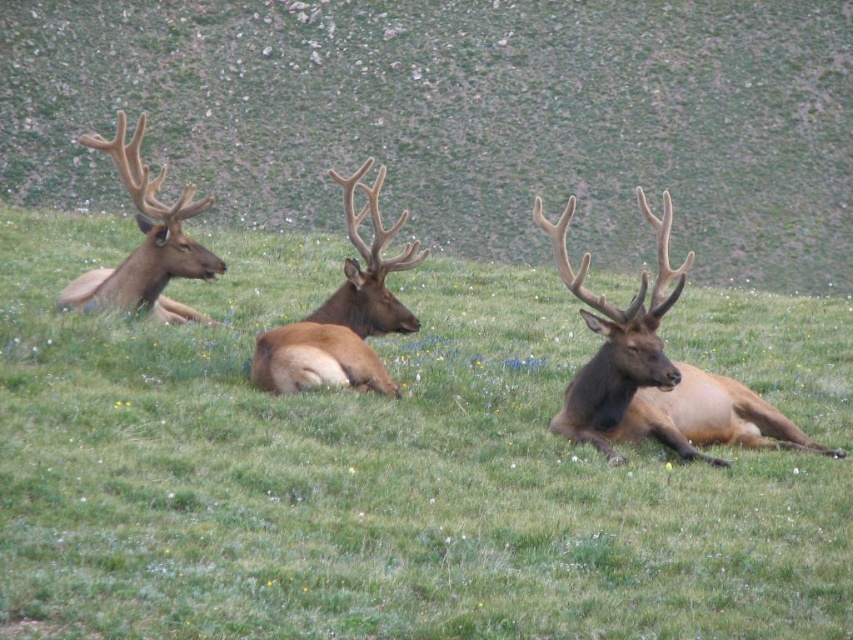
Question: Is the position of brown velvet elk at center more distant than that of brown velvet antlers at left?

Choices:
 (A) no
 (B) yes

Answer: (B)

Question: Which point is farther to the camera?

Choices:
 (A) green grass at center
 (B) brown velvet antlers at left

Answer: (B)

Question: Which of the following is the closest to the observer?

Choices:
 (A) green grass at center
 (B) brown velvet deer at center
 (C) brown velvet antlers at left

Answer: (A)

Question: Does green grass at center have a smaller size compared to brown velvet deer at center?

Choices:
 (A) yes
 (B) no

Answer: (B)

Question: Based on their relative distances, which object is farther from the brown velvet deer at center?

Choices:
 (A) brown velvet antler at center
 (B) brown velvet antlers at left
 (C) brown velvet elk at center
 (D) green grass at center

Answer: (C)

Question: Where is green grass at center located in relation to brown velvet antlers at left in the image?

Choices:
 (A) below
 (B) above

Answer: (A)